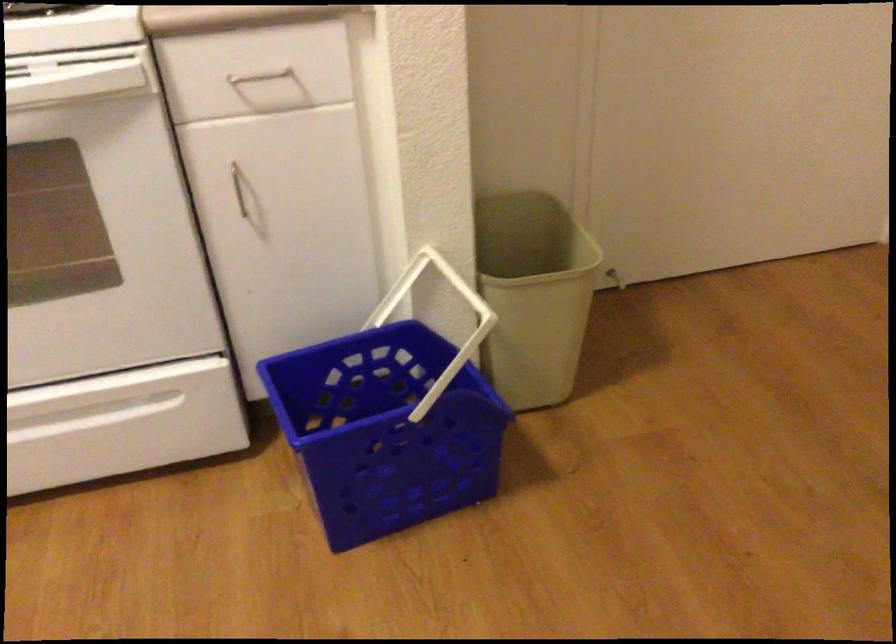
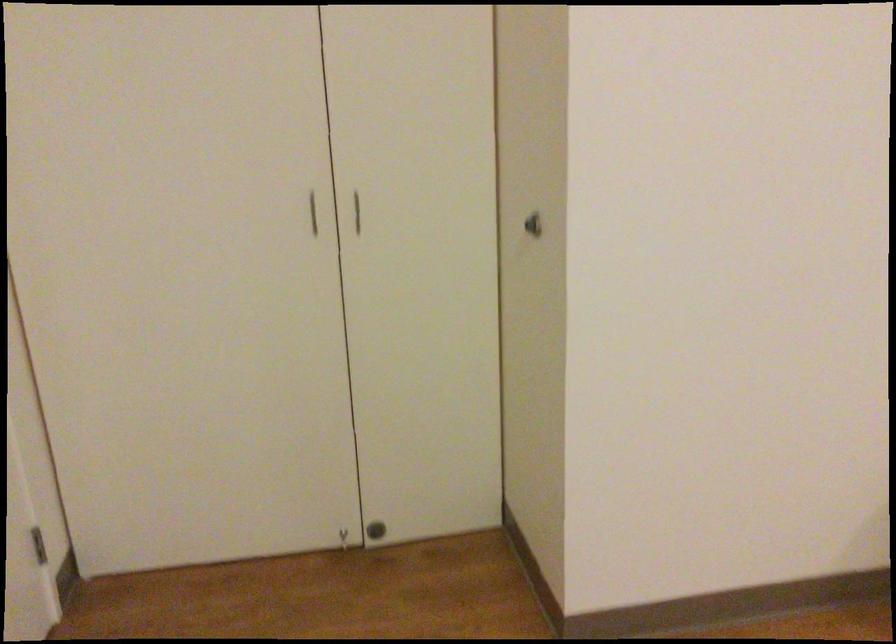
Question: The camera is either moving clockwise (left) or counter-clockwise (right) around the object. The first image is from the beginning of the video and the second image is from the end. Is the camera moving left or right when shooting the video?

Choices:
 (A) Left
 (B) Right

Answer: (A)